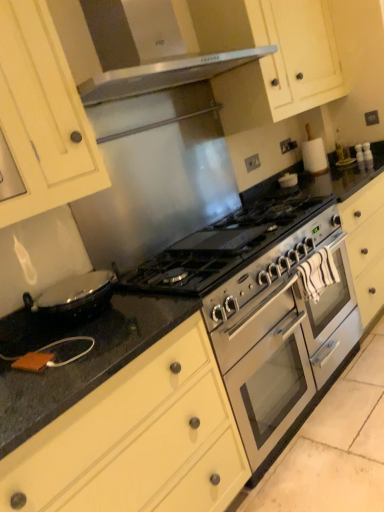
Question: Considering the relative sizes of stainless steel gas stove at center and matte white cabinet at upper left, the 2th cabinetry from the bottom, in the image provided, is stainless steel gas stove at center wider than matte white cabinet at upper left, the 2th cabinetry from the bottom,?

Choices:
 (A) no
 (B) yes

Answer: (B)

Question: Is stainless steel gas stove at center to the right of matte white cabinet at upper left, positioned as the 2th cabinetry in top-to-bottom order, from the viewer's perspective?

Choices:
 (A) yes
 (B) no

Answer: (A)

Question: Is stainless steel gas stove at center located outside matte white cabinet at upper left, positioned as the 2th cabinetry in top-to-bottom order?

Choices:
 (A) yes
 (B) no

Answer: (A)

Question: Would you consider stainless steel gas stove at center to be distant from matte white cabinet at upper left, the 2th cabinetry from the bottom?

Choices:
 (A) yes
 (B) no

Answer: (B)

Question: Does stainless steel gas stove at center have a lesser width compared to matte white cabinet at upper left, the 2th cabinetry from the bottom?

Choices:
 (A) no
 (B) yes

Answer: (A)

Question: From a real-world perspective, relative to matte white cabinet at upper left, positioned as the 2th cabinetry in top-to-bottom order, is matte cream drawer at lower left, placed as the 3th cabinetry when sorted from top to bottom, vertically above or below?

Choices:
 (A) above
 (B) below

Answer: (B)

Question: In the image, is matte cream drawer at lower left, placed as the 3th cabinetry when sorted from top to bottom, positioned in front of or behind matte white cabinet at upper left, the 2th cabinetry from the bottom?

Choices:
 (A) behind
 (B) front

Answer: (B)

Question: Would you say matte cream drawer at lower left, positioned as the 1th cabinetry in bottom-to-top order, is to the left or to the right of matte white cabinet at upper left, positioned as the 2th cabinetry in top-to-bottom order, in the picture?

Choices:
 (A) right
 (B) left

Answer: (A)

Question: Looking at their shapes, would you say matte cream drawer at lower left, placed as the 3th cabinetry when sorted from top to bottom, is wider or thinner than matte white cabinet at upper left, positioned as the 2th cabinetry in top-to-bottom order?

Choices:
 (A) thin
 (B) wide

Answer: (B)

Question: In terms of width, does stainless steel gas stove at center look wider or thinner when compared to matte cream cabinet at upper center, placed as the third cabinetry when sorted from bottom to top?

Choices:
 (A) wide
 (B) thin

Answer: (A)

Question: From the image's perspective, is stainless steel gas stove at center above or below matte cream cabinet at upper center, placed as the third cabinetry when sorted from bottom to top?

Choices:
 (A) below
 (B) above

Answer: (A)

Question: Choose the correct answer: Is stainless steel gas stove at center inside matte cream cabinet at upper center, acting as the 1th cabinetry starting from the top, or outside it?

Choices:
 (A) outside
 (B) inside

Answer: (A)

Question: Based on their sizes in the image, would you say stainless steel gas stove at center is bigger or smaller than matte cream cabinet at upper center, placed as the third cabinetry when sorted from bottom to top?

Choices:
 (A) small
 (B) big

Answer: (A)

Question: Is point (283, 197) positioned closer to the camera than point (200, 387)?

Choices:
 (A) farther
 (B) closer

Answer: (A)

Question: Is stainless steel gas stove at center to the left or to the right of matte cream drawer at lower left, positioned as the 1th cabinetry in bottom-to-top order, in the image?

Choices:
 (A) right
 (B) left

Answer: (A)